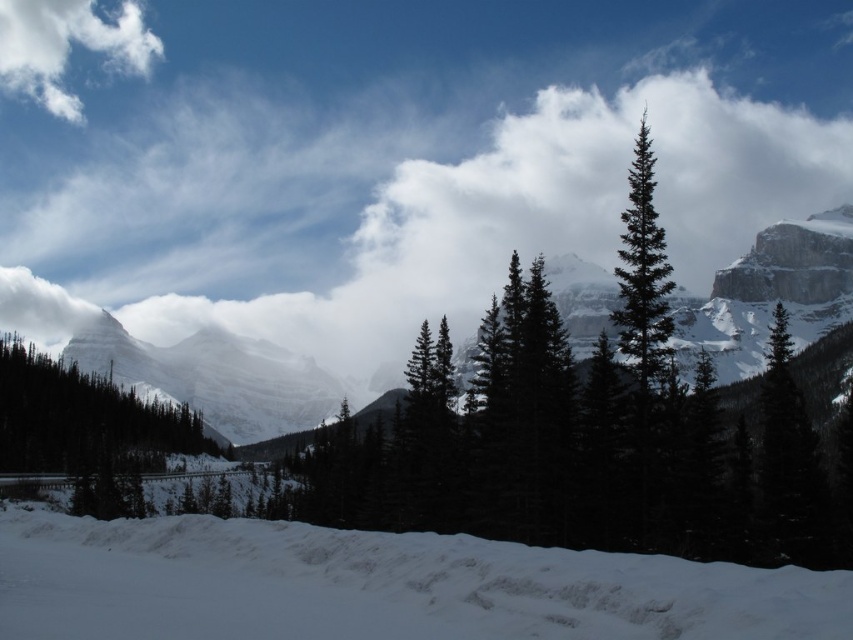
Question: Which object is farther from the camera taking this photo?

Choices:
 (A) white snow at lower center
 (B) snowy granite mountain at center
 (C) dark green textured pine tree at left
 (D) white fluffy cloud at upper left

Answer: (D)

Question: Is white snow at lower center closer to camera compared to white fluffy cloud at upper left?

Choices:
 (A) no
 (B) yes

Answer: (B)

Question: Estimate the real-world distances between objects in this image. Which object is farther from the dark green textured evergreen at right?

Choices:
 (A) white fluffy cloud at upper left
 (B) snowy granite mountain at center
 (C) white snow at lower center

Answer: (A)

Question: Can you confirm if snowy granite mountain at center is smaller than dark green textured evergreen at right?

Choices:
 (A) no
 (B) yes

Answer: (A)

Question: Which point is farther from the camera taking this photo?

Choices:
 (A) (653, 211)
 (B) (817, 461)

Answer: (B)

Question: Does snowy granite mountain at center have a greater width compared to white fluffy cloud at upper left?

Choices:
 (A) yes
 (B) no

Answer: (A)